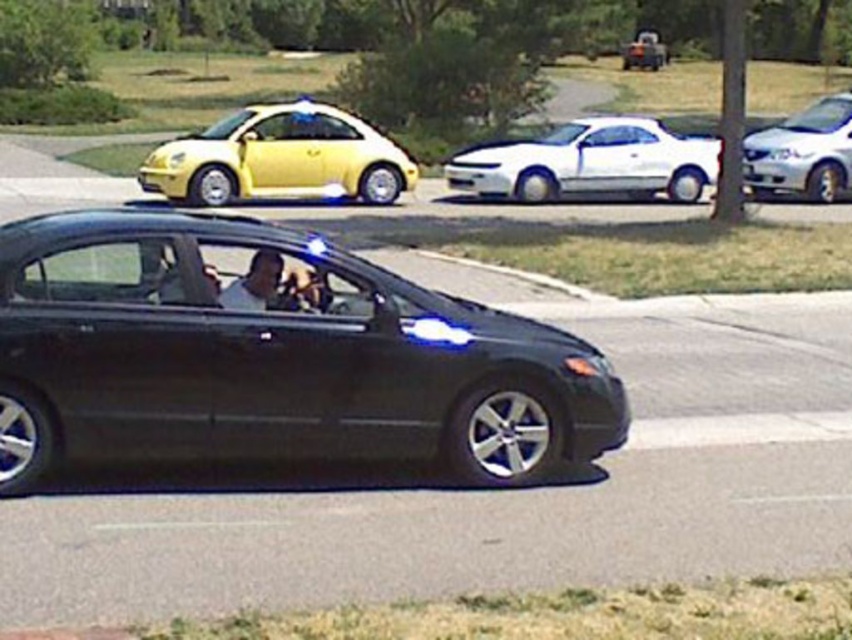
In the scene shown: Who is positioned more to the left, white glossy sedan at upper right or metallic silver truck at upper center?

From the viewer's perspective, white glossy sedan at upper right appears more on the left side.

Between white glossy sedan at upper right and metallic silver truck at upper center, which one is positioned higher?

metallic silver truck at upper center is above.

At what (x,y) coordinates should I click in order to perform the action: click on white glossy sedan at upper right. Please return your answer as a coordinate pair (x, y). This screenshot has height=640, width=852. Looking at the image, I should click on click(x=803, y=152).

Identify the location of white glossy sedan at upper right. The width and height of the screenshot is (852, 640). (803, 152).

Is glossy black sedan at center to the right of white matte shirt at center from the viewer's perspective?

Correct, you'll find glossy black sedan at center to the right of white matte shirt at center.

Does point (194, 346) come behind point (268, 250)?

No.

Where is `glossy black sedan at center`? glossy black sedan at center is located at coordinates point(271,356).

Based on the photo, is glossy black sedan at center further to the viewer compared to white glossy sedan at upper right?

That is False.

Does point (521, 317) come closer to viewer compared to point (789, 152)?

Yes, it is.

This screenshot has width=852, height=640. Identify the location of glossy black sedan at center. (271, 356).